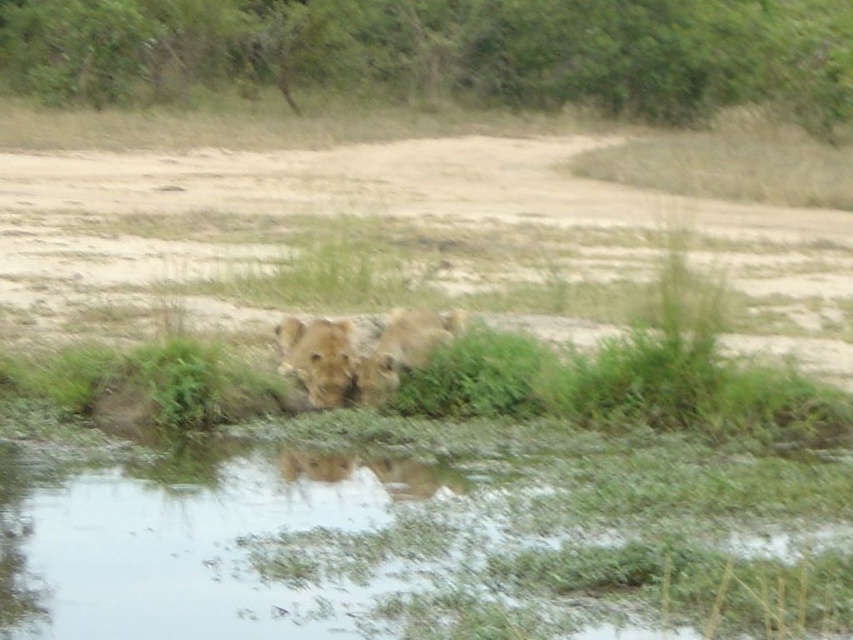
Question: Which object is the farthest from the clear water at lower center?

Choices:
 (A) golden fur lion at center
 (B) fuzzy golden lion at center

Answer: (A)

Question: Which object is farther from the camera taking this photo?

Choices:
 (A) fuzzy golden lion at center
 (B) golden fur lion at center
 (C) clear water at lower center

Answer: (A)

Question: Does fuzzy golden lion at center come in front of golden fur lion at center?

Choices:
 (A) yes
 (B) no

Answer: (B)

Question: Is clear water at lower center bigger than golden fur lion at center?

Choices:
 (A) no
 (B) yes

Answer: (B)

Question: Estimate the real-world distances between objects in this image. Which object is farther from the fuzzy golden lion at center?

Choices:
 (A) golden fur lion at center
 (B) clear water at lower center

Answer: (B)

Question: In this image, where is fuzzy golden lion at center located relative to golden fur lion at center?

Choices:
 (A) above
 (B) below

Answer: (B)